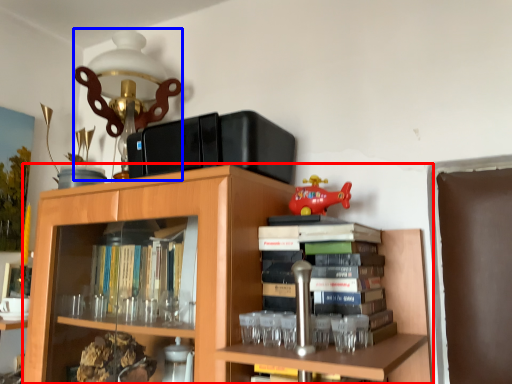
Question: Which object is closer to the camera taking this photo, bookcase (highlighted by a red box) or table lamp (highlighted by a blue box)?

Choices:
 (A) bookcase
 (B) table lamp

Answer: (A)